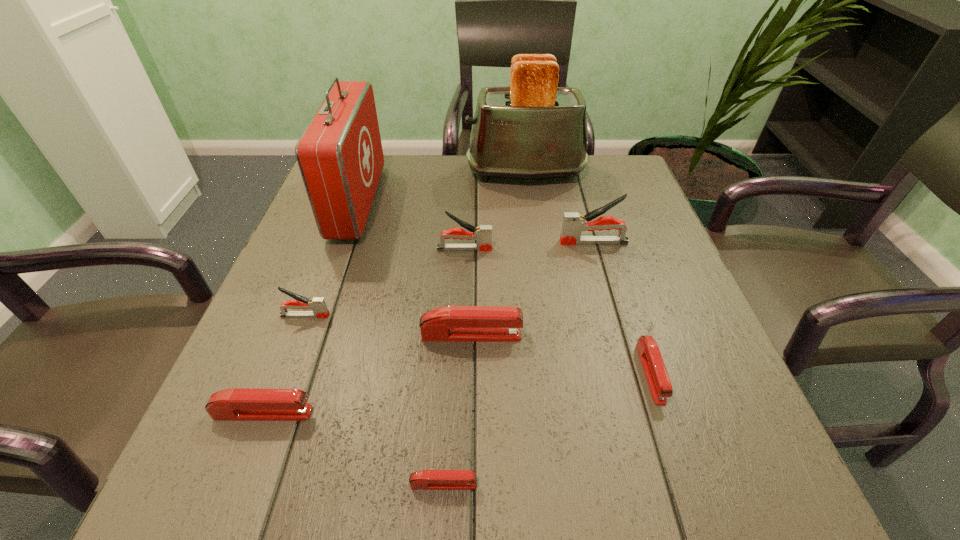
Find the location of `free space located on the handle side of the biggest gray stapler`. free space located on the handle side of the biggest gray stapler is located at coordinates (519, 242).

At what (x,y) coordinates should I click in order to perform the action: click on free space located 0.270m on the handle side of the biggest gray stapler. Please return your answer as a coordinate pair (x, y). This screenshot has height=540, width=960. Looking at the image, I should click on (440, 242).

Where is `vacant region located on the handle side of the biggest gray stapler`? This screenshot has width=960, height=540. vacant region located on the handle side of the biggest gray stapler is located at coordinates (516, 242).

This screenshot has width=960, height=540. I want to click on vacant region located on the handle side of the second gray stapler from left to right, so click(614, 248).

Locate an element on the screen. The image size is (960, 540). vacant space located 0.300m on the handle side of the smallest gray stapler is located at coordinates (488, 315).

I want to click on vacant space located 0.270m on the front-facing side of the sixth farthest object, so point(670,335).

Identify the location of free region located on the front-facing side of the second biggest red stapler. This screenshot has width=960, height=540. (530, 413).

In order to click on vacant area situated 0.140m on the front-facing side of the rightmost red stapler in this screenshot , I will do `click(691, 498)`.

The width and height of the screenshot is (960, 540). I want to click on blank area located 0.230m on the front-facing side of the nearest red stapler, so click(x=642, y=484).

This screenshot has height=540, width=960. In order to click on toaster located at the far edge in this screenshot , I will do `click(533, 129)`.